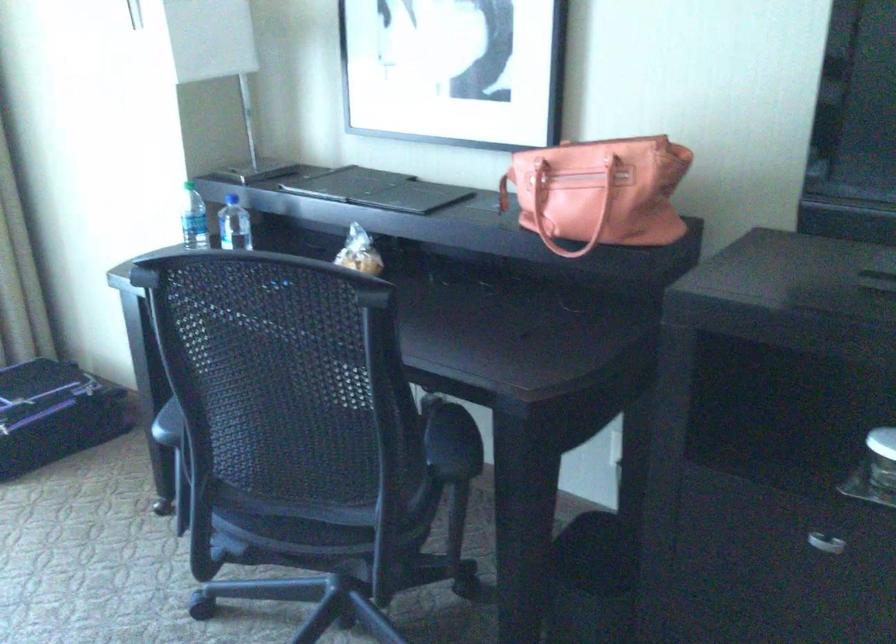
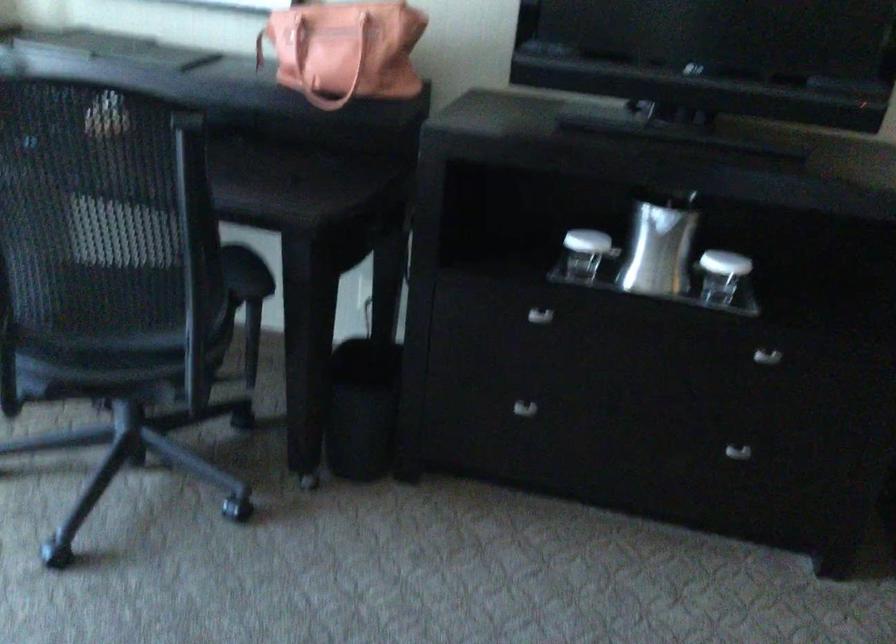
Where in the second image is the point corresponding to point 300,431 from the first image?

(107, 265)